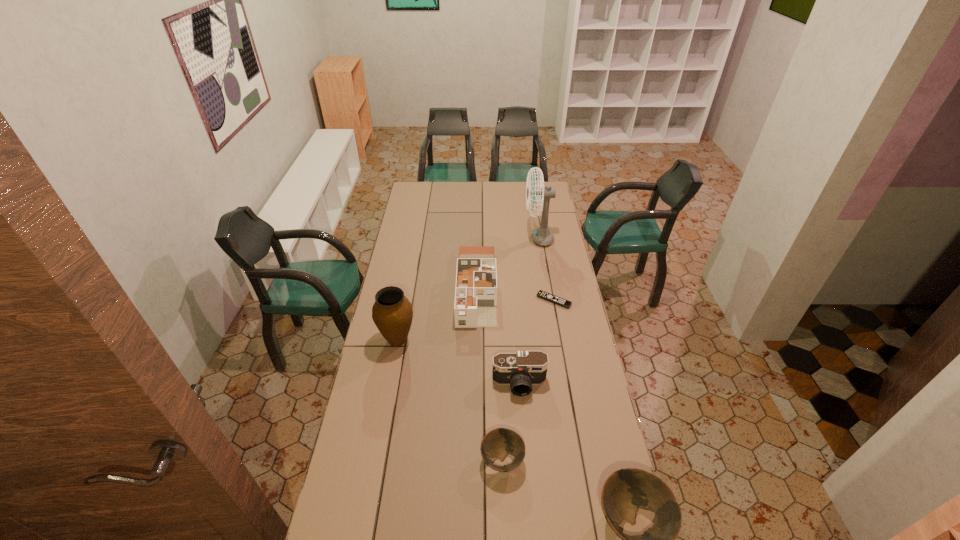
The height and width of the screenshot is (540, 960). Identify the location of object that is the nearest to the dollhouse. (392, 313).

Identify the location of free space in the image that satisfies the following two spatial constraints: 1. at the entrance of the remote control; 2. on the right side of the dollhouse. The width and height of the screenshot is (960, 540). (476, 300).

Identify the location of free spot that satisfies the following two spatial constraints: 1. at the entrance of the sixth farthest object; 2. on the right side of the dollhouse. (475, 460).